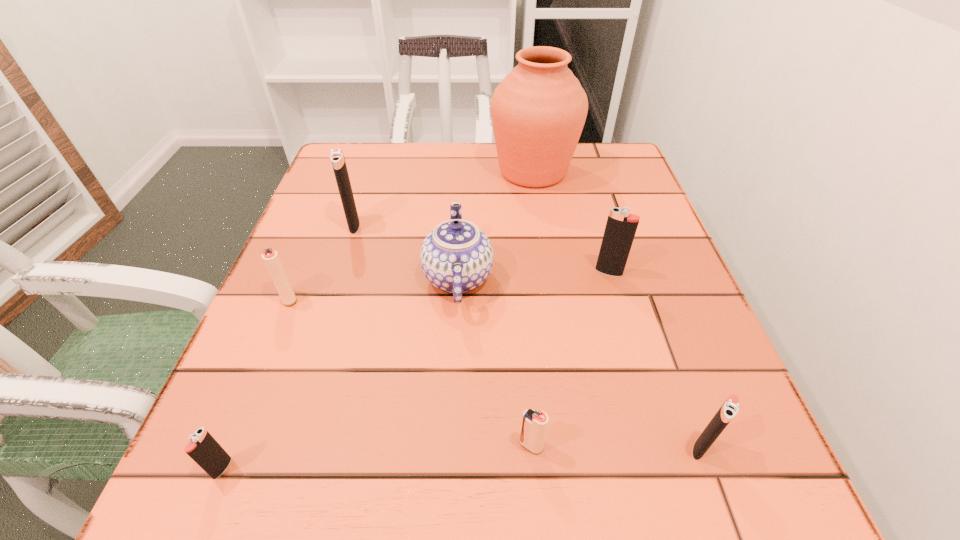
Find the location of `the left red igniter`. the left red igniter is located at coordinates (271, 258).

Where is `the third farthest igniter`? The image size is (960, 540). the third farthest igniter is located at coordinates (271, 258).

At what (x,y) coordinates should I click in order to perform the action: click on the nearer red igniter. Please return your answer as a coordinate pair (x, y). The image size is (960, 540). Looking at the image, I should click on (534, 423).

At what (x,y) coordinates should I click in order to perform the action: click on the right red igniter. Please return your answer as a coordinate pair (x, y). Looking at the image, I should click on (x=534, y=423).

Locate an element on the screen. the smallest black igniter is located at coordinates (203, 448).

This screenshot has height=540, width=960. In order to click on vacant area situated on the left of the farthest object in this screenshot , I will do `click(430, 171)`.

Where is `free space located on the back of the farthest igniter`? The height and width of the screenshot is (540, 960). free space located on the back of the farthest igniter is located at coordinates (381, 143).

The width and height of the screenshot is (960, 540). What are the coordinates of `free location located 0.300m on the front of the third smallest black igniter` in the screenshot? It's located at (654, 426).

Where is `vacant space located 0.100m at the spout of the chinaware`? vacant space located 0.100m at the spout of the chinaware is located at coordinates (545, 278).

You are a GUI agent. You are given a task and a screenshot of the screen. Output one action in this format:
    pyautogui.click(x=<x>, y=<y>)
    Task: Click on the vacant space situated on the left of the rightmost black igniter
    The image size is (960, 540).
    Given the screenshot: What is the action you would take?
    pyautogui.click(x=486, y=448)